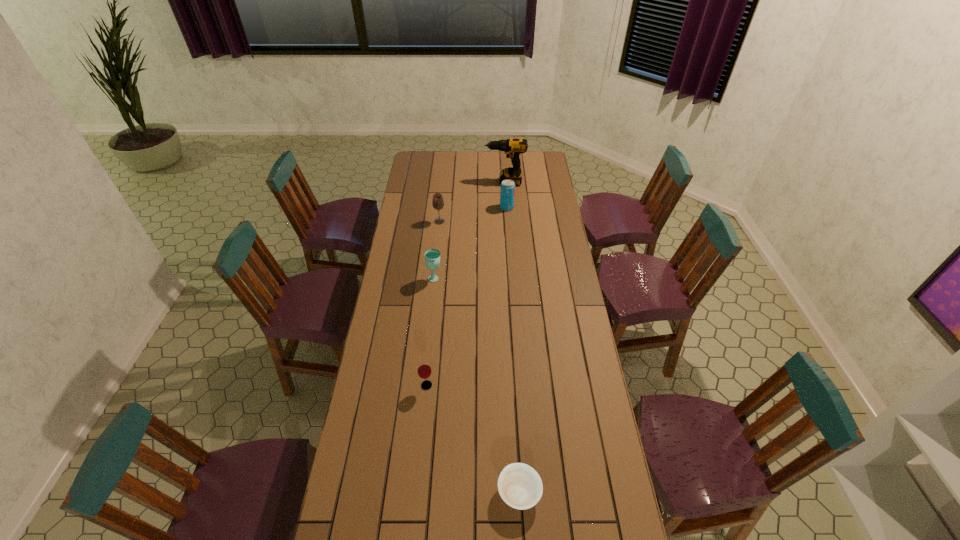
Locate an element on the screen. The image size is (960, 540). free region located at the tip of the tallest object is located at coordinates (420, 183).

This screenshot has height=540, width=960. In order to click on free space located at the tip of the tallest object in this screenshot , I will do `click(431, 183)`.

Image resolution: width=960 pixels, height=540 pixels. What are the coordinates of `vacant space situated 0.190m on the back of the farthest glass` in the screenshot? It's located at click(x=443, y=197).

At what (x,y) coordinates should I click in order to perform the action: click on free space located on the front of the fifth nearest object. Please return your answer as a coordinate pair (x, y). Image resolution: width=960 pixels, height=540 pixels. Looking at the image, I should click on (510, 246).

The width and height of the screenshot is (960, 540). I want to click on vacant space situated 0.270m on the right of the second nearest glass, so click(x=502, y=278).

What are the coordinates of `free space located 0.200m on the back of the second shortest object` in the screenshot? It's located at pos(431,336).

You are a GUI agent. You are given a task and a screenshot of the screen. Output one action in this format:
    pyautogui.click(x=<x>, y=<y>)
    Task: Click on the vacant space located 0.280m on the back of the nearest object
    This screenshot has height=540, width=960.
    Given the screenshot: What is the action you would take?
    pyautogui.click(x=514, y=391)

This screenshot has height=540, width=960. I want to click on free space at the far edge, so click(x=452, y=167).

This screenshot has height=540, width=960. I want to click on free space at the left edge of the desktop, so [358, 522].

Identify the location of free space at the right edge of the desktop. The width and height of the screenshot is (960, 540). (561, 402).